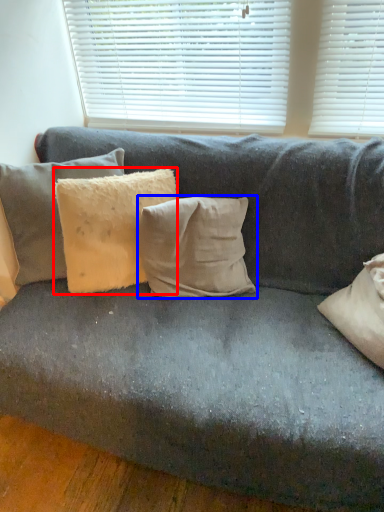
Question: Which object is further to the camera taking this photo, pillow (highlighted by a red box) or pillow (highlighted by a blue box)?

Choices:
 (A) pillow
 (B) pillow

Answer: (B)